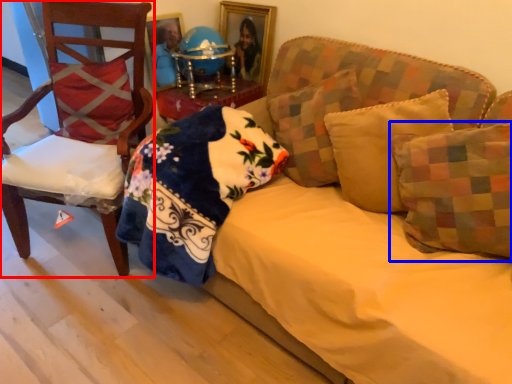
Question: Which point is further to the camera, chair (highlighted by a red box) or pillow (highlighted by a blue box)?

Choices:
 (A) chair
 (B) pillow

Answer: (A)